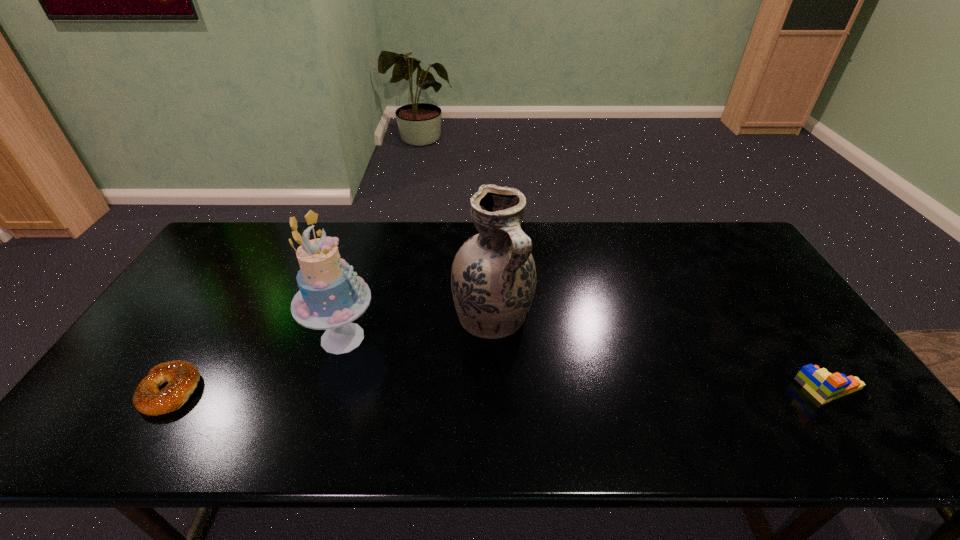
Identify the location of free point at the far edge. The width and height of the screenshot is (960, 540). tap(298, 248).

Find the location of a particular element. vacant space at the near edge of the desktop is located at coordinates (795, 402).

This screenshot has height=540, width=960. In the image, there is a desktop. Identify the location of vacant space at the right edge. (742, 299).

Image resolution: width=960 pixels, height=540 pixels. Find the location of `vacant space at the far left corner of the desktop`. vacant space at the far left corner of the desktop is located at coordinates (231, 236).

Image resolution: width=960 pixels, height=540 pixels. Find the location of `empty space between the second object from right to left and the shortest object`. empty space between the second object from right to left and the shortest object is located at coordinates (332, 354).

The image size is (960, 540). Find the location of `vacant space that's between the third tallest object and the bagel`. vacant space that's between the third tallest object and the bagel is located at coordinates (501, 389).

Where is `free spot between the leftmost object and the cake`? The width and height of the screenshot is (960, 540). free spot between the leftmost object and the cake is located at coordinates (256, 364).

At what (x,y) coordinates should I click in order to perform the action: click on free space between the second object from left to right and the third object from left to right. Please return your answer as a coordinate pair (x, y). The height and width of the screenshot is (540, 960). Looking at the image, I should click on (418, 327).

The image size is (960, 540). In order to click on unoccupied position between the bagel and the third tallest object in this screenshot , I will do (x=501, y=389).

Find the location of a particular element. The image size is (960, 540). unoccupied position between the rightmost object and the vase is located at coordinates (661, 353).